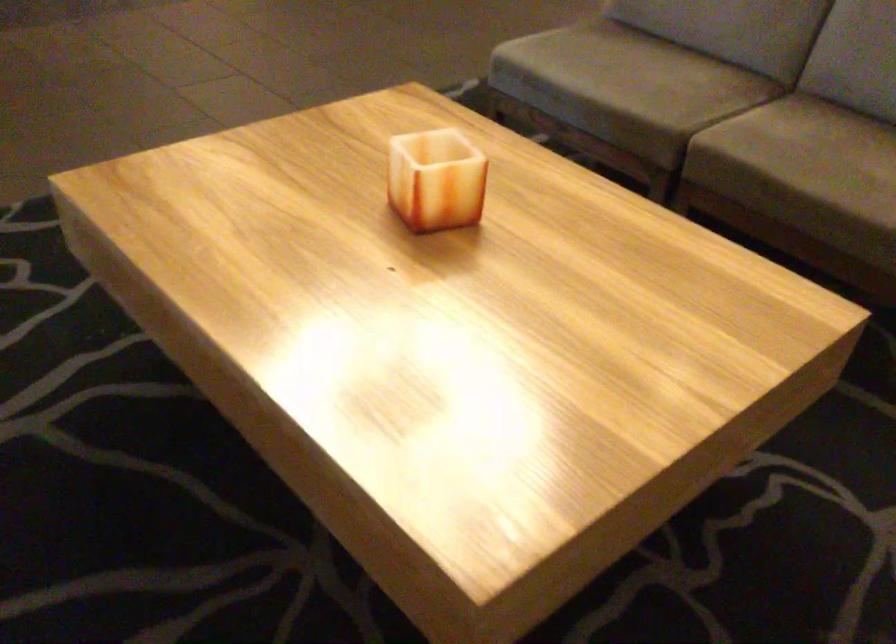
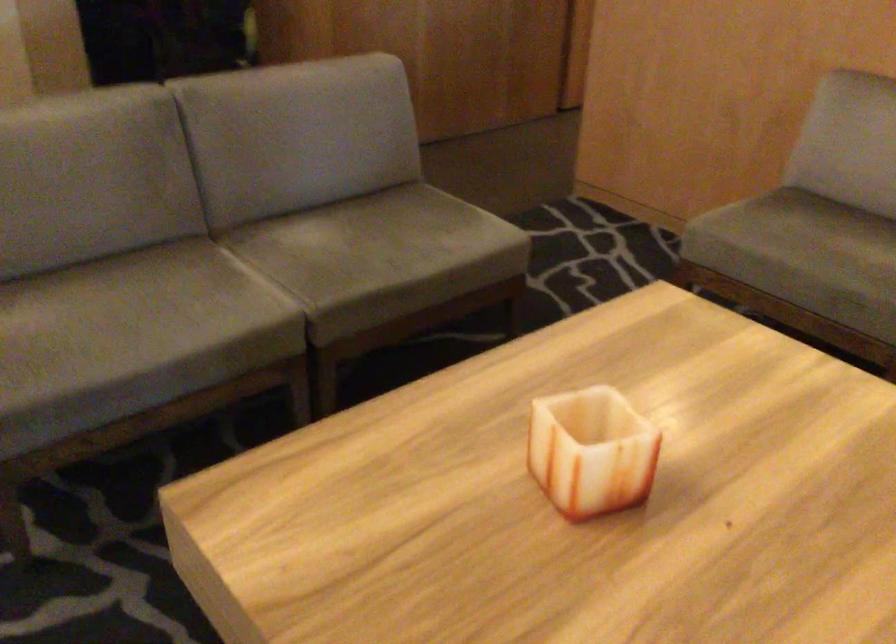
The point at (616, 69) is marked in the first image. Where is the corresponding point in the second image?

(139, 322)